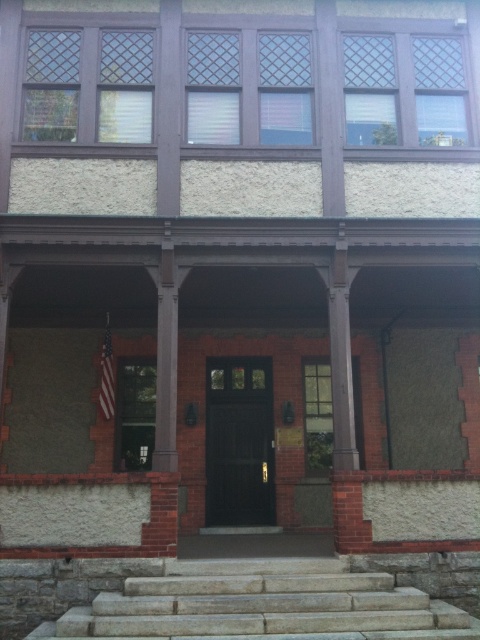
Does shiny dark wood door at center come behind red fabric american flag at center?

Yes, it is.

In the scene shown: Can you confirm if shiny dark wood door at center is positioned above red fabric american flag at center?

Actually, shiny dark wood door at center is below red fabric american flag at center.

Is point (238, 412) closer to camera compared to point (100, 362)?

No.

Identify the location of shiny dark wood door at center. (239, 442).

Can you confirm if gray stone stairs at lower center is bigger than shiny dark wood door at center?

Correct, gray stone stairs at lower center is larger in size than shiny dark wood door at center.

From the picture: Measure the distance between gray stone stairs at lower center and shiny dark wood door at center.

3.67 meters

Is point (299, 634) closer to viewer compared to point (216, 452)?

Yes, point (299, 634) is closer to viewer.

Image resolution: width=480 pixels, height=640 pixels. Find the location of `gray stone stairs at lower center`. gray stone stairs at lower center is located at coordinates (260, 604).

The image size is (480, 640). What are the coordinates of `gray stone stairs at lower center` in the screenshot? It's located at (260, 604).

Is gray stone stairs at lower center to the left of red fabric american flag at center from the viewer's perspective?

In fact, gray stone stairs at lower center is to the right of red fabric american flag at center.

Between point (84, 632) and point (108, 368), which one is positioned in front?

Positioned in front is point (84, 632).

The height and width of the screenshot is (640, 480). In order to click on gray stone stairs at lower center in this screenshot , I will do `click(260, 604)`.